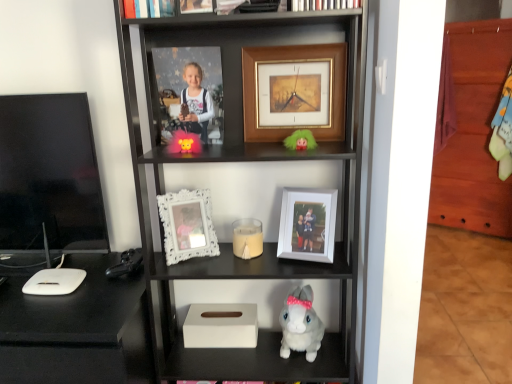
Question: Is white matte picture frame at center, the 5th picture frame positioned from the top, positioned far away from black glossy tv at left?

Choices:
 (A) yes
 (B) no

Answer: (B)

Question: Is the position of white matte picture frame at center, the 1th picture frame positioned from the bottom, less distant than that of black glossy tv at left?

Choices:
 (A) yes
 (B) no

Answer: (A)

Question: Is white matte picture frame at center, the 1th picture frame positioned from the bottom, located outside black glossy tv at left?

Choices:
 (A) no
 (B) yes

Answer: (B)

Question: Can you confirm if white matte picture frame at center, the 5th picture frame positioned from the top, is taller than black glossy tv at left?

Choices:
 (A) yes
 (B) no

Answer: (B)

Question: Is white matte picture frame at center, the 1th picture frame positioned from the bottom, facing towards black glossy tv at left?

Choices:
 (A) no
 (B) yes

Answer: (A)

Question: Considering the relative positions of white matte picture frame at center, the 5th picture frame positioned from the top, and black glossy tv at left in the image provided, is white matte picture frame at center, the 5th picture frame positioned from the top, to the right of black glossy tv at left from the viewer's perspective?

Choices:
 (A) no
 (B) yes

Answer: (B)

Question: Does black matte desk at left have a greater width compared to white ornate picture frame at center, which ranks as the 4th picture frame in top-to-bottom order?

Choices:
 (A) no
 (B) yes

Answer: (B)

Question: Does black matte desk at left turn towards white ornate picture frame at center, which ranks as the 4th picture frame in top-to-bottom order?

Choices:
 (A) no
 (B) yes

Answer: (A)

Question: Is white ornate picture frame at center, which ranks as the 4th picture frame in top-to-bottom order, completely or partially inside black matte desk at left?

Choices:
 (A) no
 (B) yes

Answer: (A)

Question: Considering the relative positions of black matte desk at left and white ornate picture frame at center, which ranks as the 4th picture frame in top-to-bottom order, in the image provided, is black matte desk at left to the right of white ornate picture frame at center, which ranks as the 4th picture frame in top-to-bottom order, from the viewer's perspective?

Choices:
 (A) yes
 (B) no

Answer: (B)

Question: From a real-world perspective, is black matte desk at left located higher than white ornate picture frame at center, which ranks as the 4th picture frame in top-to-bottom order?

Choices:
 (A) no
 (B) yes

Answer: (A)

Question: Is the position of black matte desk at left less distant than that of white ornate picture frame at center, the 2th picture frame when ordered from bottom to top?

Choices:
 (A) yes
 (B) no

Answer: (A)

Question: Considering the relative positions of white matte candle at center and white matte picture frame at center, the 5th picture frame positioned from the top, in the image provided, is white matte candle at center to the right of white matte picture frame at center, the 5th picture frame positioned from the top, from the viewer's perspective?

Choices:
 (A) yes
 (B) no

Answer: (B)